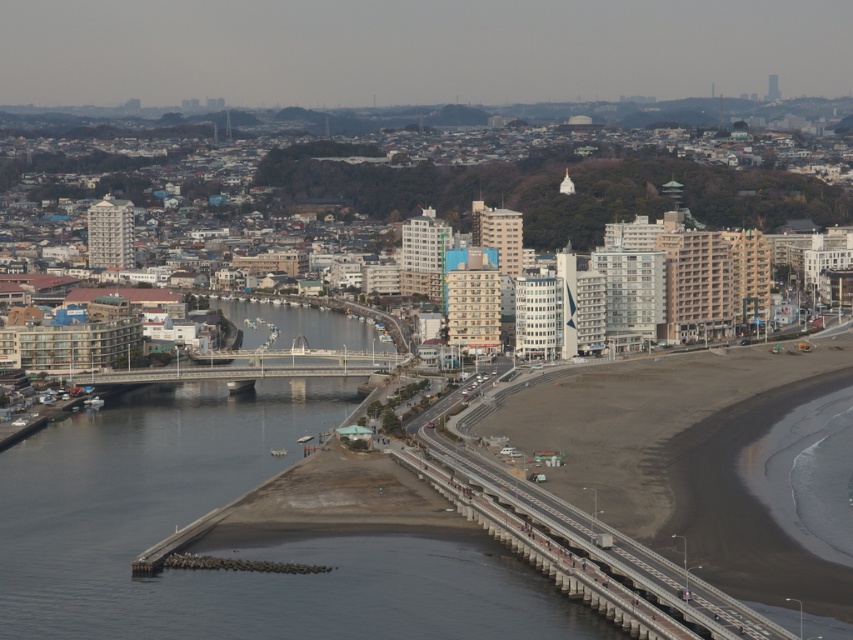
Question: From the image, what is the correct spatial relationship of concrete bridge at lower center in relation to concrete gray bridge at center?

Choices:
 (A) right
 (B) left

Answer: (A)

Question: Is concrete bridge at lower center positioned before concrete gray bridge at center?

Choices:
 (A) no
 (B) yes

Answer: (A)

Question: Based on their relative distances, which object is farther from the smooth concrete bridge at center?

Choices:
 (A) concrete bridge at lower center
 (B) concrete gray bridge at center

Answer: (A)

Question: Which point appears closest to the camera in this image?

Choices:
 (A) (358, 365)
 (B) (447, 480)

Answer: (A)

Question: Which of the following is the farthest from the observer?

Choices:
 (A) concrete gray bridge at center
 (B) concrete bridge at lower center

Answer: (B)

Question: Can you confirm if concrete gray bridge at center is positioned above smooth concrete bridge at center?

Choices:
 (A) yes
 (B) no

Answer: (B)